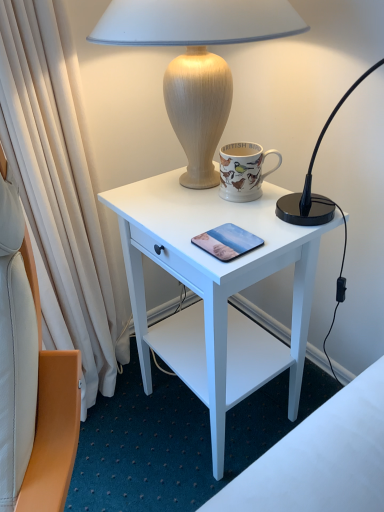
The width and height of the screenshot is (384, 512). Describe the element at coordinates (215, 292) in the screenshot. I see `white matte desk at center` at that location.

The width and height of the screenshot is (384, 512). In order to click on porcelain mug with colorful birds at upper center in this screenshot , I will do `click(243, 170)`.

Is white matte desk at center thinner than porcelain mug with colorful birds at upper center?

No.

From the picture: Measure the distance from white matte desk at center to porcelain mug with colorful birds at upper center.

white matte desk at center is 27.56 centimeters from porcelain mug with colorful birds at upper center.

From a real-world perspective, who is located lower, white matte desk at center or porcelain mug with colorful birds at upper center?

white matte desk at center, from a real-world perspective.

Considering the points (185, 373) and (239, 201), which point is in front, point (185, 373) or point (239, 201)?

The point (239, 201) is in front.

Is white matte desk at center looking in the opposite direction of wooden lamp at upper center?

No, white matte desk at center is not facing away from wooden lamp at upper center.

From the picture: Which is correct: white matte desk at center is inside wooden lamp at upper center, or outside of it?

white matte desk at center cannot be found inside wooden lamp at upper center.

Locate an element on the screen. The image size is (384, 512). lamp in front of the white matte desk at center is located at coordinates (196, 61).

Is white matte desk at center to the right of wooden lamp at upper center from the viewer's perspective?

Indeed, white matte desk at center is positioned on the right side of wooden lamp at upper center.

Is matte glass pad at center aimed at wooden lamp at upper center?

No, matte glass pad at center is not aimed at wooden lamp at upper center.

Is matte glass pad at center bigger or smaller than wooden lamp at upper center?

Clearly, matte glass pad at center is smaller in size than wooden lamp at upper center.

Are matte glass pad at center and wooden lamp at upper center making contact?

No, matte glass pad at center is not with wooden lamp at upper center.

Does matte glass pad at center appear on the left side of wooden lamp at upper center?

No, matte glass pad at center is not to the left of wooden lamp at upper center.

Find the location of a particular element. Image resolution: width=384 pixels, height=512 pixels. desk beneath the wooden lamp at upper center (from a real-world perspective) is located at coordinates (215, 292).

Is wooden lamp at upper center directly adjacent to white matte desk at center?

No, wooden lamp at upper center is not next to white matte desk at center.

Does wooden lamp at upper center appear on the right side of white matte desk at center?

Incorrect, wooden lamp at upper center is not on the right side of white matte desk at center.

Considering the sizes of matte glass pad at center and white matte desk at center in the image, is matte glass pad at center wider or thinner than white matte desk at center?

matte glass pad at center is thinner than white matte desk at center.

This screenshot has width=384, height=512. Identify the location of pad lying on the right of white matte desk at center. (227, 242).

Considering the sizes of objects matte glass pad at center and white matte desk at center in the image provided, who is bigger, matte glass pad at center or white matte desk at center?

white matte desk at center.

Would you say matte glass pad at center is outside white matte desk at center?

Actually, matte glass pad at center is at least partially inside white matte desk at center.

Is porcelain mug with colorful birds at upper center surrounding wooden lamp at upper center?

No, wooden lamp at upper center is not inside porcelain mug with colorful birds at upper center.

Considering the sizes of objects porcelain mug with colorful birds at upper center and wooden lamp at upper center in the image provided, who is taller, porcelain mug with colorful birds at upper center or wooden lamp at upper center?

wooden lamp at upper center.

This screenshot has height=512, width=384. I want to click on lamp in front of the porcelain mug with colorful birds at upper center, so click(196, 61).

Which of these two, porcelain mug with colorful birds at upper center or white matte desk at center, is thinner?

With smaller width is porcelain mug with colorful birds at upper center.

Considering the relative sizes of porcelain mug with colorful birds at upper center and white matte desk at center in the image provided, is porcelain mug with colorful birds at upper center bigger than white matte desk at center?

Actually, porcelain mug with colorful birds at upper center might be smaller than white matte desk at center.

In order to click on coffee cup located on the right of white matte desk at center in this screenshot , I will do `click(243, 170)`.

In the scene shown: Is porcelain mug with colorful birds at upper center positioned far away from white matte desk at center?

No, porcelain mug with colorful birds at upper center is not far away from white matte desk at center.

Locate an element on the screen. This screenshot has height=512, width=384. desk beneath the porcelain mug with colorful birds at upper center (from a real-world perspective) is located at coordinates (215, 292).

Find the location of a particular element. The height and width of the screenshot is (512, 384). lamp located on the left of white matte desk at center is located at coordinates (196, 61).

From the image, which object appears to be farther from wooden lamp at upper center, white matte desk at center or matte glass pad at center?

The object further to wooden lamp at upper center is matte glass pad at center.

Estimate the real-world distances between objects in this image. Which object is further from matte glass pad at center, porcelain mug with colorful birds at upper center or white matte desk at center?

white matte desk at center lies further to matte glass pad at center than the other object.

Which object lies nearer to the anchor point porcelain mug with colorful birds at upper center, white matte desk at center or matte glass pad at center?

matte glass pad at center is positioned closer to the anchor porcelain mug with colorful birds at upper center.

In the scene shown: Estimate the real-world distances between objects in this image. Which object is closer to white matte desk at center, matte glass pad at center or porcelain mug with colorful birds at upper center?

The object closer to white matte desk at center is porcelain mug with colorful birds at upper center.

Which object lies further to the anchor point porcelain mug with colorful birds at upper center, wooden lamp at upper center or matte glass pad at center?

matte glass pad at center is positioned further to the anchor porcelain mug with colorful birds at upper center.

Estimate the real-world distances between objects in this image. Which object is closer to porcelain mug with colorful birds at upper center, white matte desk at center or wooden lamp at upper center?

wooden lamp at upper center lies closer to porcelain mug with colorful birds at upper center than the other object.

When comparing their distances from wooden lamp at upper center, does porcelain mug with colorful birds at upper center or white matte desk at center seem further?

The object further to wooden lamp at upper center is white matte desk at center.

Looking at the image, which one is located closer to wooden lamp at upper center, white matte desk at center or porcelain mug with colorful birds at upper center?

porcelain mug with colorful birds at upper center lies closer to wooden lamp at upper center than the other object.

You are a GUI agent. You are given a task and a screenshot of the screen. Output one action in this format:
    pyautogui.click(x=<x>, y=<y>)
    Task: Click on the coffee cup between wooden lamp at upper center and matte glass pad at center from top to bottom
    This screenshot has height=512, width=384.
    Given the screenshot: What is the action you would take?
    pyautogui.click(x=243, y=170)

At what (x,y) coordinates should I click in order to perform the action: click on pad between wooden lamp at upper center and white matte desk at center in the up-down direction. Please return your answer as a coordinate pair (x, y). Looking at the image, I should click on (227, 242).

This screenshot has height=512, width=384. Identify the location of coffee cup between wooden lamp at upper center and white matte desk at center in the vertical direction. (243, 170).

Identify the location of pad between porcelain mug with colorful birds at upper center and white matte desk at center from top to bottom. This screenshot has height=512, width=384. (227, 242).